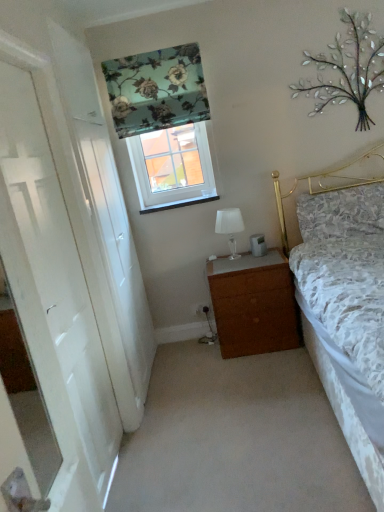
Locate an element on the screen. free location in front of white glass table lamp at center is located at coordinates (227, 262).